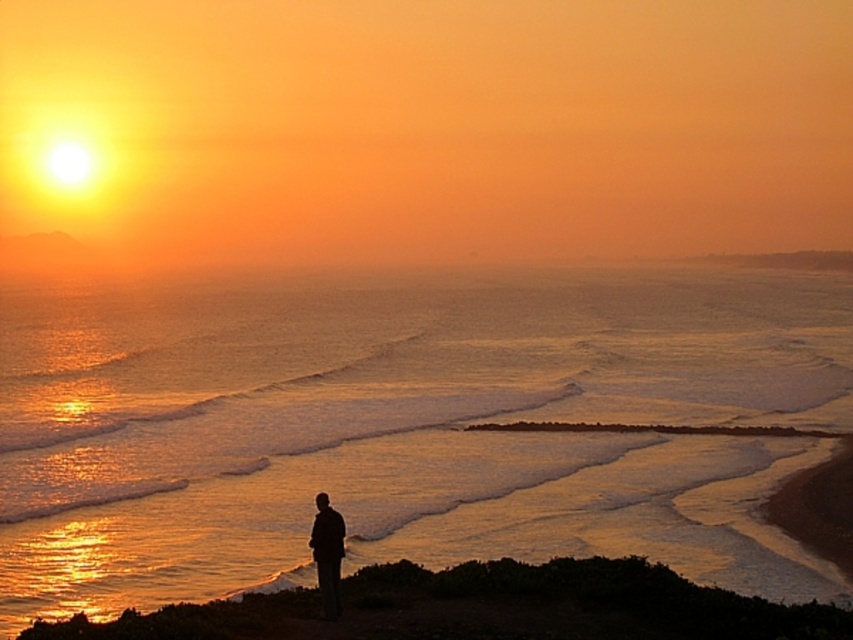
You are standing at the edge of the beach and see the smooth sand shoreline at lower center and the silhouette figure at lower center. Which object is nearer to you?

The smooth sand shoreline at lower center is closer to the viewer than the silhouette figure at lower center.

You are a photographer trying to capture the sunset scene. You notice the glistening water at center and the silhouette figure at lower center. Which object in the scene appears bigger in the photo?

The glistening water at center appears bigger in the photo because it has a larger size compared to the silhouette figure at lower center.

You are a photographer positioned at the edge of the beach. You want to capture the sunset with both the glistening water at center and the smooth sand shoreline at lower center in the frame. Which object should you pan your camera towards first to ensure both are included?

You should pan your camera towards the glistening water at center first because it is located to the left of the smooth sand shoreline at lower center, ensuring both are captured in the frame.